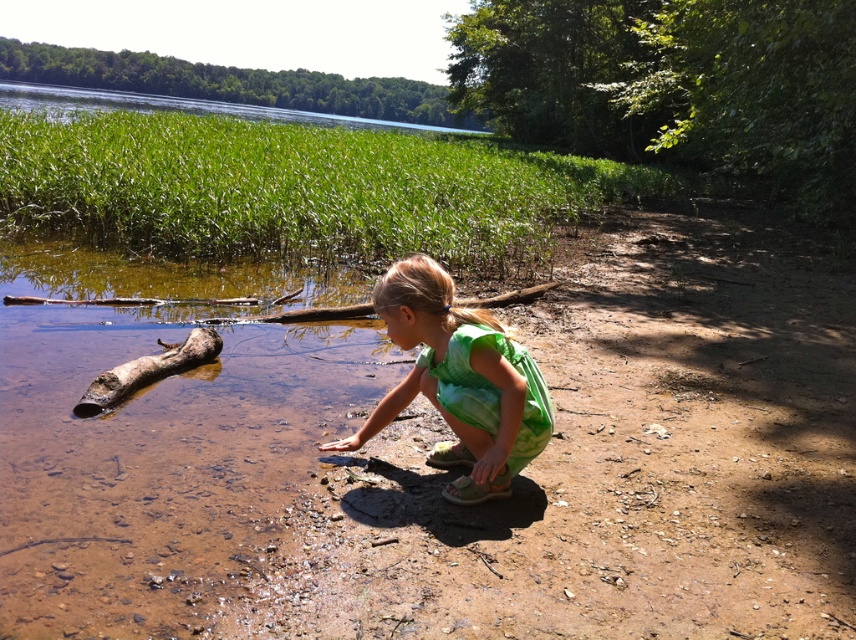
You are a small toy boat that is 10 cm tall. You want to sail from the water to the shore. Which object will you hit first when approaching the shore? The brown sandy soil at lower center or the brown rough log at left?

The brown rough log at left is shorter than the brown sandy soil at lower center, so the toy boat will hit the brown rough log at left first when approaching the shore.

Consider the image. You are standing at the point with coordinates point (x=176, y=353) and want to walk to the point with coordinates point (x=470, y=131). Which direction should you move in to reach your destination?

To reach point (x=470, y=131) from point (x=176, y=353), you should move towards the upper left direction since point (x=470, y=131) is behind point (x=176, y=353).